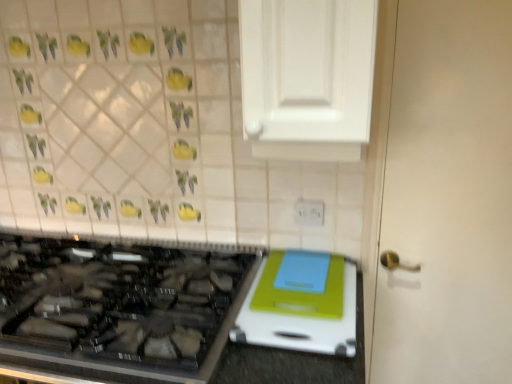
Question: Is white plastic electric outlet at upper center bigger or smaller than black glass gas stove at lower left?

Choices:
 (A) small
 (B) big

Answer: (A)

Question: From a real-world perspective, relative to black glass gas stove at lower left, is white plastic electric outlet at upper center vertically above or below?

Choices:
 (A) above
 (B) below

Answer: (A)

Question: Which object is the closest to the white matte door at right?

Choices:
 (A) white plastic cutting board at lower right
 (B) white plastic electric outlet at upper center
 (C) white glossy cabinet at upper center
 (D) black glass gas stove at lower left

Answer: (C)

Question: Estimate the real-world distances between objects in this image. Which object is closer to the white matte door at right?

Choices:
 (A) white plastic cutting board at lower right
 (B) white glossy cabinet at upper center
 (C) white plastic electric outlet at upper center
 (D) black glass gas stove at lower left

Answer: (B)